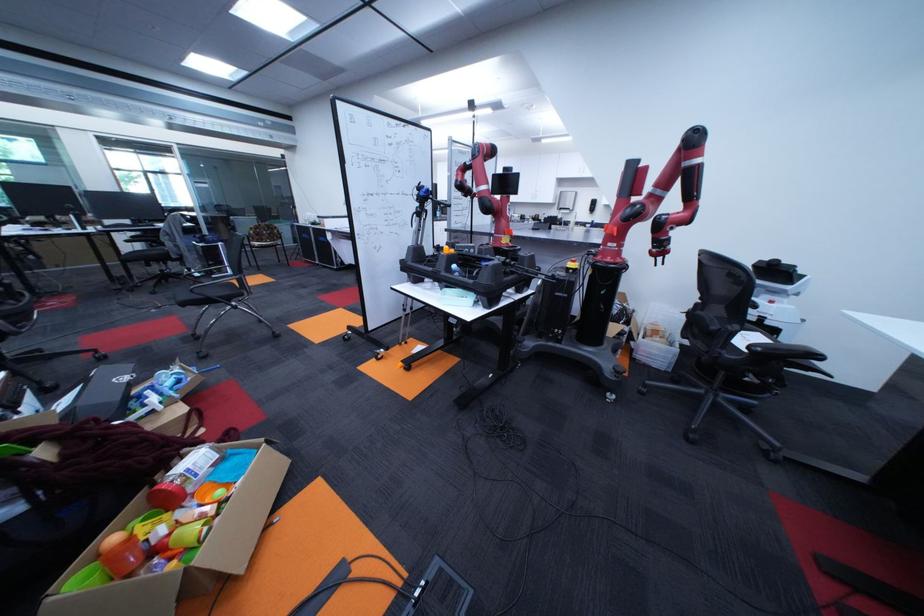
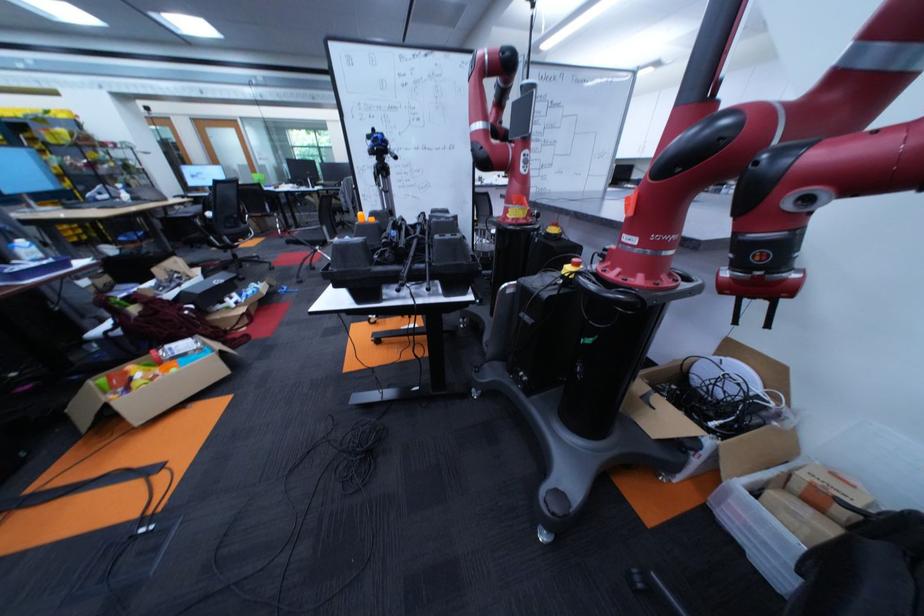
Locate, in the second image, the point that corresponds to pixel 143 541 in the first image.

(140, 371)